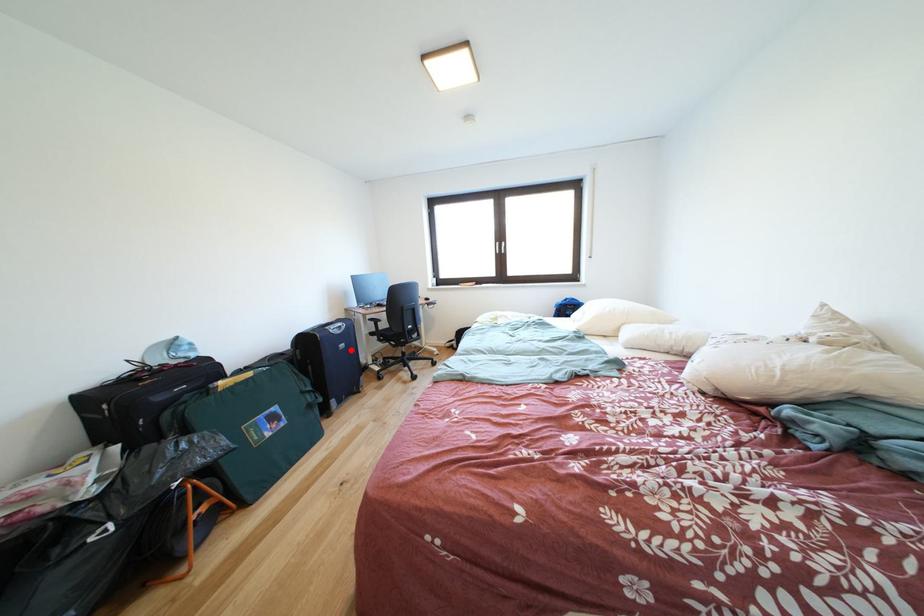
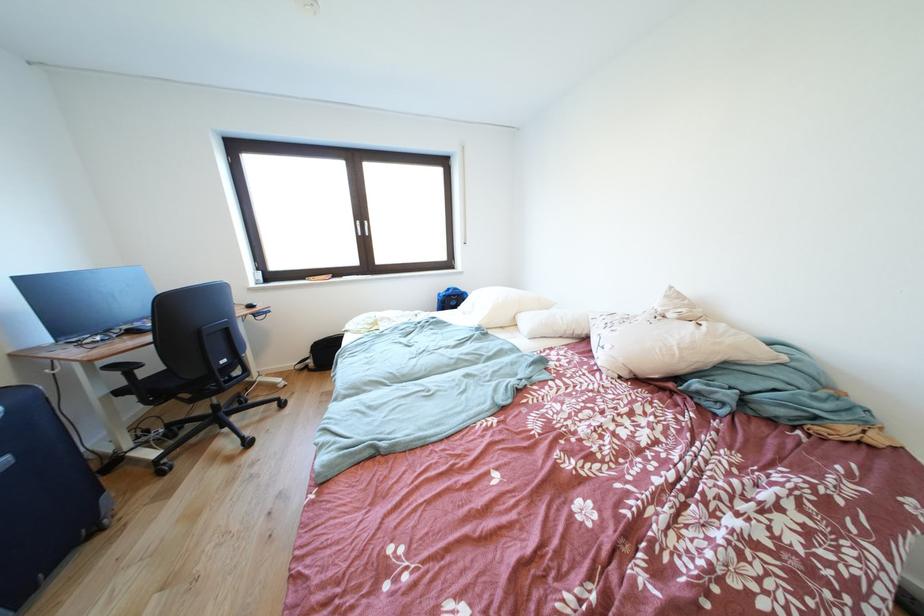
The point at the highlighted location is marked in the first image. Where is the corresponding point in the second image?

(8, 468)